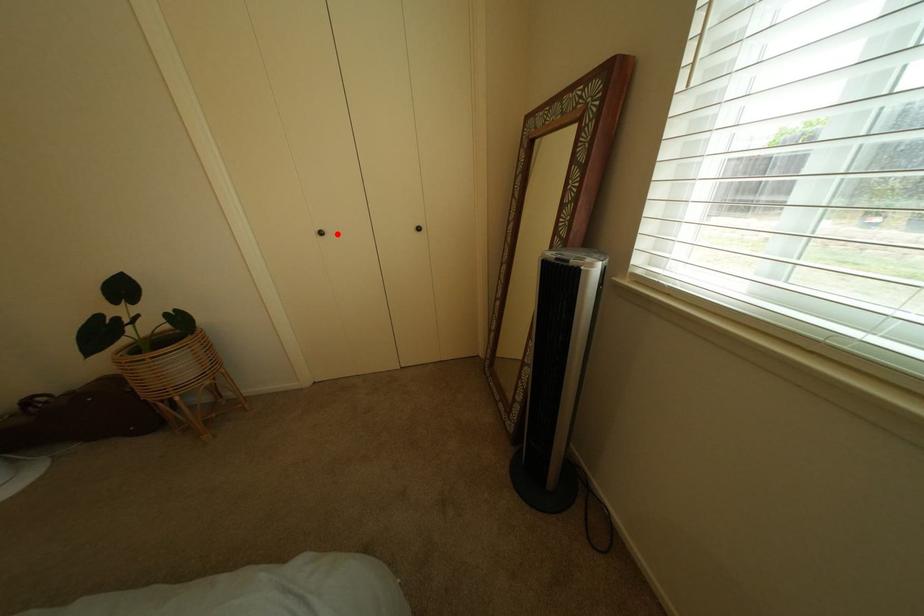
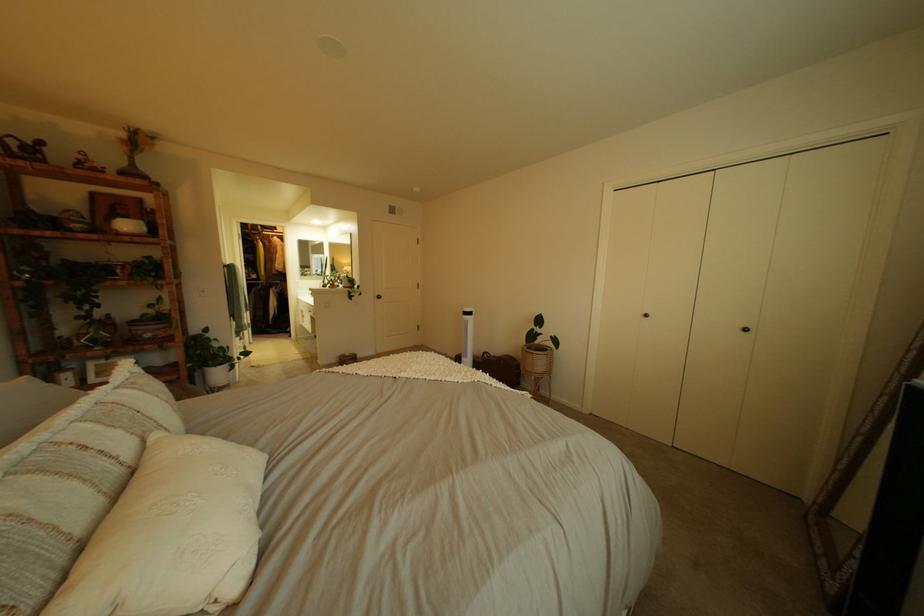
In the second image, find the point that corresponds to the highlighted location in the first image.

(662, 317)